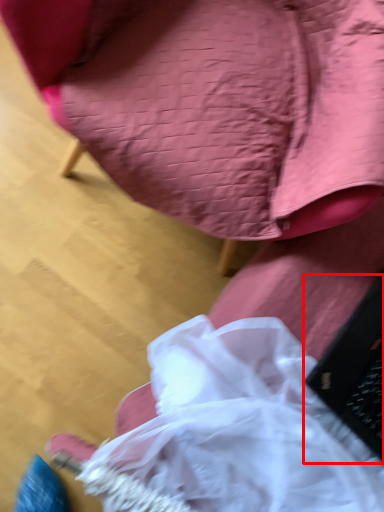
Question: From the image's perspective, what is the correct spatial relationship of laptop (annotated by the red box) in relation to chair?

Choices:
 (A) below
 (B) above

Answer: (A)